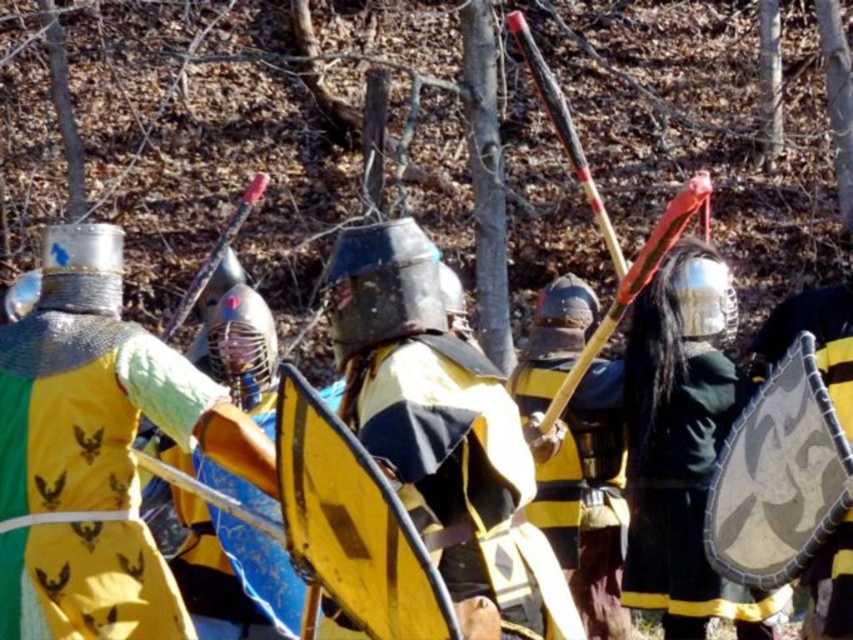
Question: Is the position of shiny silver helmet at center less distant than that of black leather shield at right?

Choices:
 (A) yes
 (B) no

Answer: (B)

Question: Estimate the real-world distances between objects in this image. Which object is farther from the black leather shield at right?

Choices:
 (A) yellow fabric shield at center
 (B) shiny silver helmet at center

Answer: (A)

Question: Which of the following is the closest to the observer?

Choices:
 (A) yellow and black armor at center
 (B) black leather shield at right
 (C) shiny silver helmet at center
 (D) yellow fabric shield at center

Answer: (A)

Question: Is yellow fabric shield at center positioned before yellow and black armor at center?

Choices:
 (A) yes
 (B) no

Answer: (B)

Question: Which object is positioned closest to the black leather shield at right?

Choices:
 (A) yellow and black armor at center
 (B) yellow fabric shield at center

Answer: (A)

Question: Is yellow and black armor at center above shiny silver helmet at center?

Choices:
 (A) yes
 (B) no

Answer: (B)